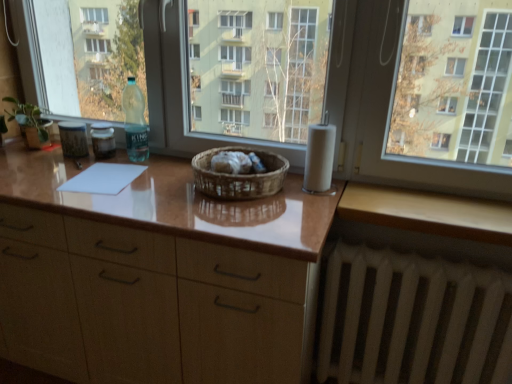
In order to click on vacant area that is in front of transparent glass window at center in this screenshot , I will do `click(158, 190)`.